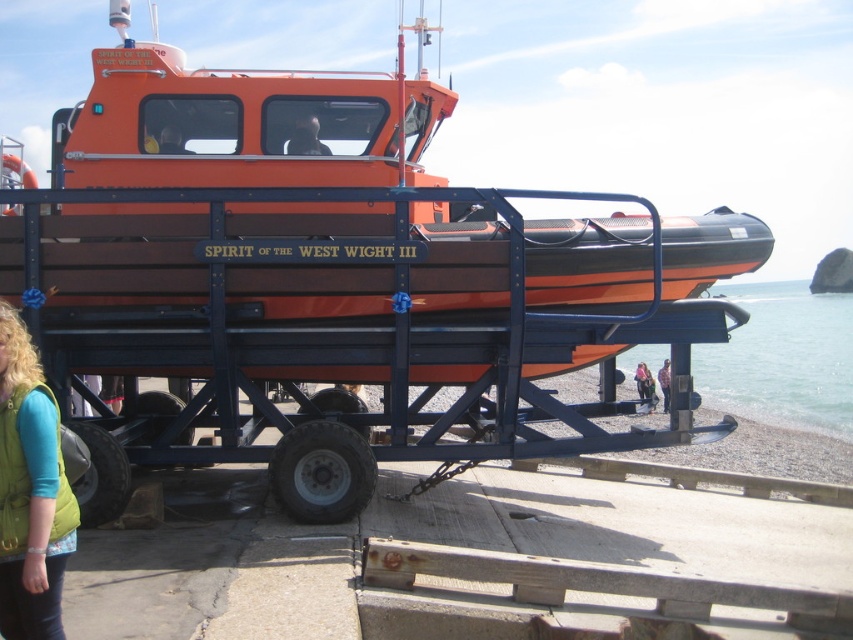
You are a safety inspector checking the lifeboat setup. The clear blue water at lower right and the green fabric vest at lower left are both in your line of sight. According to the safety guidelines, the water must be below the lifeboat platform to ensure safe deployment. Is the current arrangement compliant with the guidelines?

The clear blue water at lower right is above the green fabric vest at lower left, which means the water is higher than the platform where the vest is located. This violates the safety requirement that the water must be below the lifeboat platform for safe deployment.